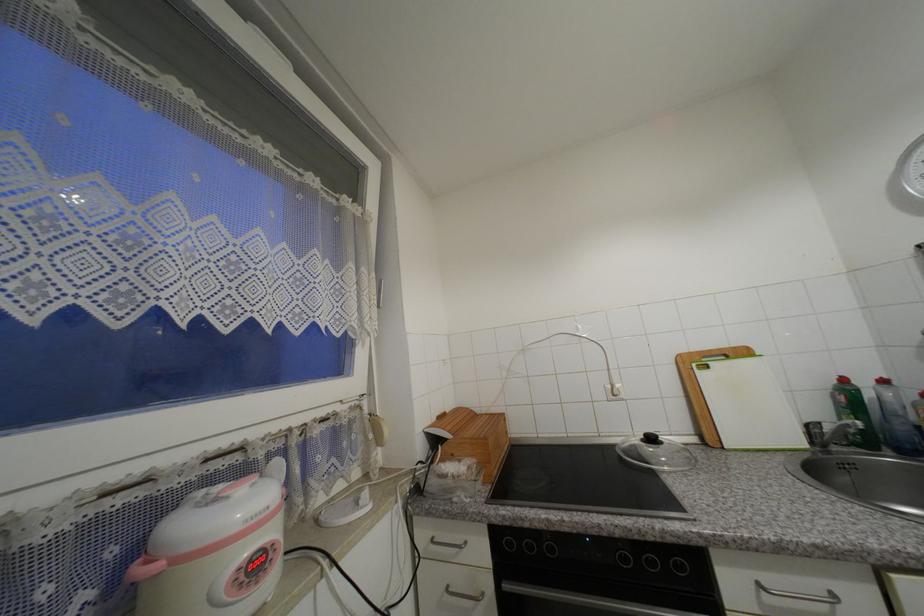
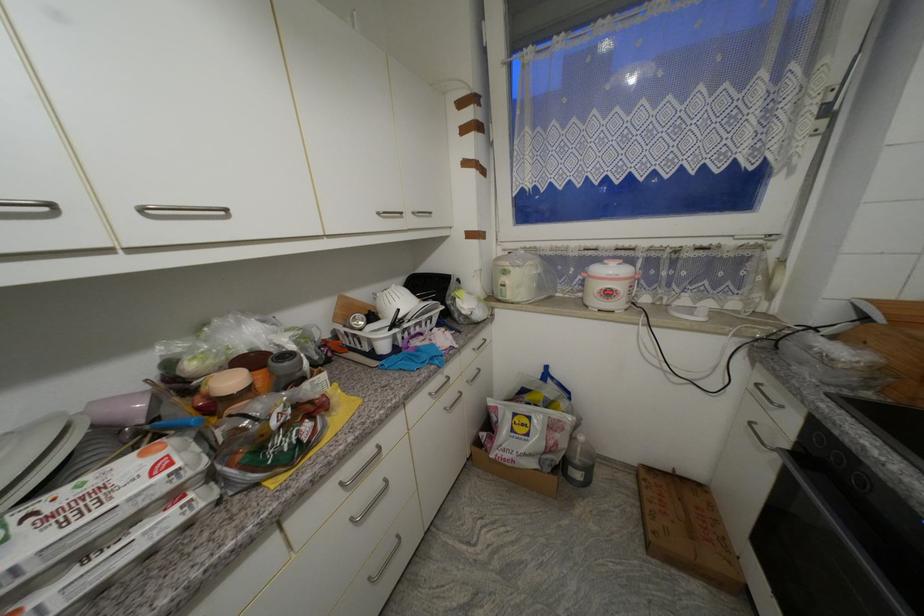
The point at (262,567) is marked in the first image. Where is the corresponding point in the second image?

(614, 294)